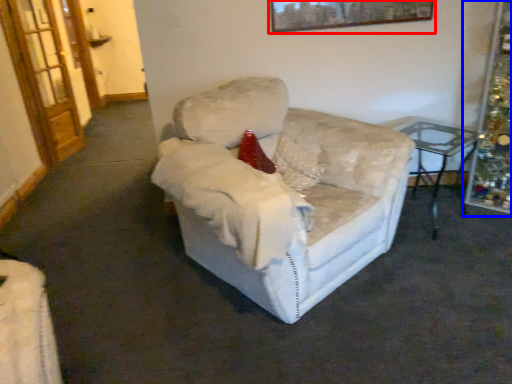
Question: Which of the following is the closest to the observer, picture frame (highlighted by a red box) or christmas decoration (highlighted by a blue box)?

Choices:
 (A) picture frame
 (B) christmas decoration

Answer: (B)